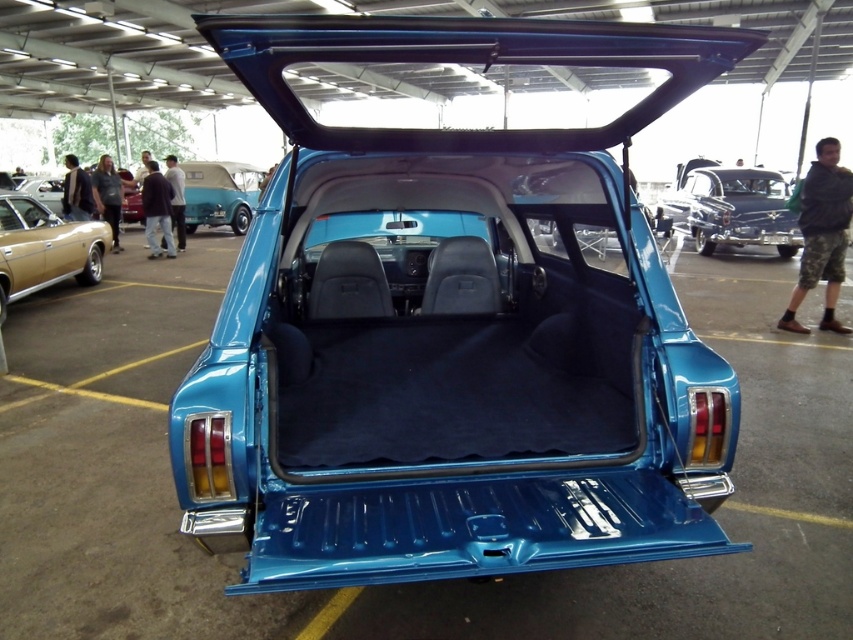
Is point (764, 193) closer to camera compared to point (21, 184)?

Yes, it is in front of point (21, 184).

Measure the distance between shiny blue sedan at center and matte black car at upper left.

They are 17.40 meters apart.

The width and height of the screenshot is (853, 640). What do you see at coordinates (730, 208) in the screenshot?
I see `shiny blue sedan at center` at bounding box center [730, 208].

Locate an element on the screen. Image resolution: width=853 pixels, height=640 pixels. shiny blue sedan at center is located at coordinates (730, 208).

Does point (694, 198) lie in front of point (196, 202)?

That is True.

Between shiny blue sedan at center and shiny blue car at center, which one is positioned higher?

shiny blue car at center is above.

Image resolution: width=853 pixels, height=640 pixels. What are the coordinates of `shiny blue sedan at center` in the screenshot? It's located at (730, 208).

Locate an element on the screen. The image size is (853, 640). shiny blue sedan at center is located at coordinates (730, 208).

Between point (248, 220) and point (61, 204), which one is positioned in front?

Point (61, 204) is in front.

Measure the distance between point (218, 220) and camera.

Point (218, 220) is 16.93 meters away from camera.

What do you see at coordinates (219, 195) in the screenshot? I see `shiny blue car at center` at bounding box center [219, 195].

This screenshot has height=640, width=853. I want to click on shiny blue car at center, so click(x=219, y=195).